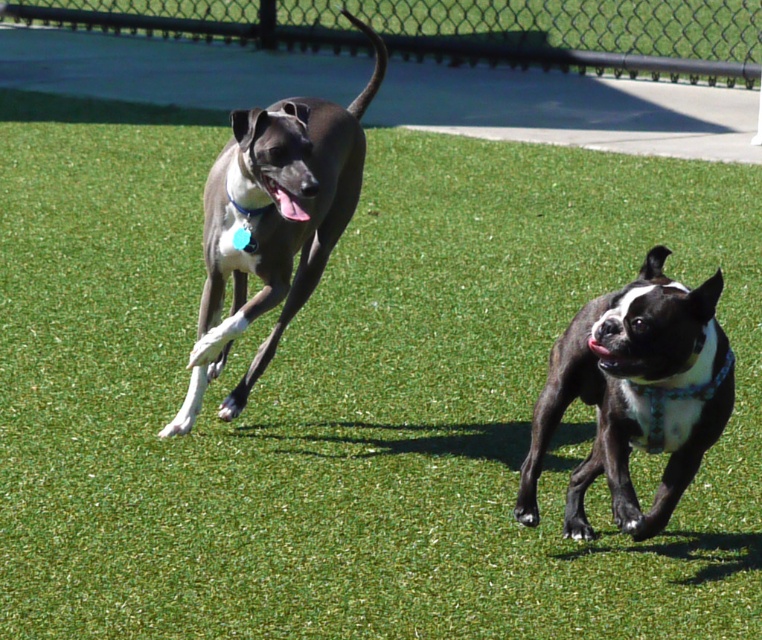
Question: Can you confirm if blue fabric neckband at upper left is positioned below black glossy mouth at lower right?

Choices:
 (A) yes
 (B) no

Answer: (B)

Question: Is blue fabric neckband at upper left to the right of black glossy mouth at lower right from the viewer's perspective?

Choices:
 (A) yes
 (B) no

Answer: (B)

Question: Which of the following is the farthest from the observer?

Choices:
 (A) (434, 58)
 (B) (245, 209)

Answer: (A)

Question: Which object appears closest to the camera in this image?

Choices:
 (A) black glossy mouth at lower right
 (B) blue fabric neckband at right
 (C) smooth gray dog at left
 (D) black/white fur dog at right

Answer: (D)

Question: Among these objects, which one is farthest from the camera?

Choices:
 (A) black/white fur dog at right
 (B) blue fabric neckband at upper left

Answer: (B)

Question: Does blue fabric neckband at right appear on the right side of pink glossy tongue at center?

Choices:
 (A) yes
 (B) no

Answer: (A)